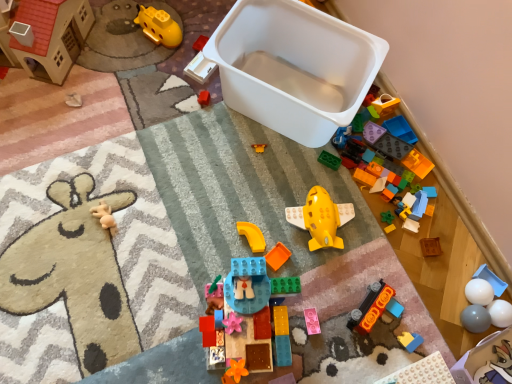
In order to click on empty space that is in between matte plastic toy at lower right, the 5th toy viewed from the right, and beige rubber bear at left, which ranks as the 15th toy in right-to-left order in this screenshot , I will do `click(237, 258)`.